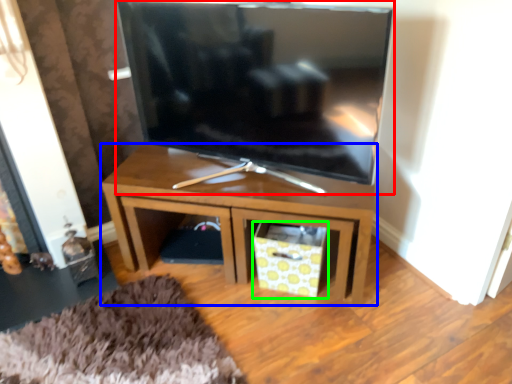
Question: Which object is positioned farthest from television (highlighted by a red box)? Select from table (highlighted by a blue box) and drawer (highlighted by a green box).

Choices:
 (A) table
 (B) drawer

Answer: (B)